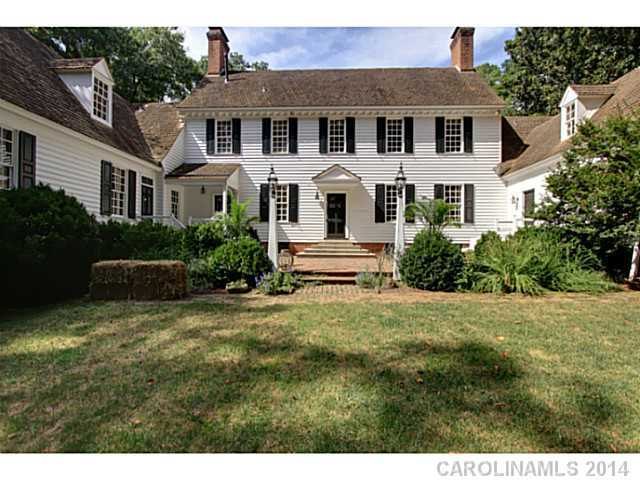
The height and width of the screenshot is (480, 640). Find the location of `stairs`. stairs is located at coordinates (324, 256).